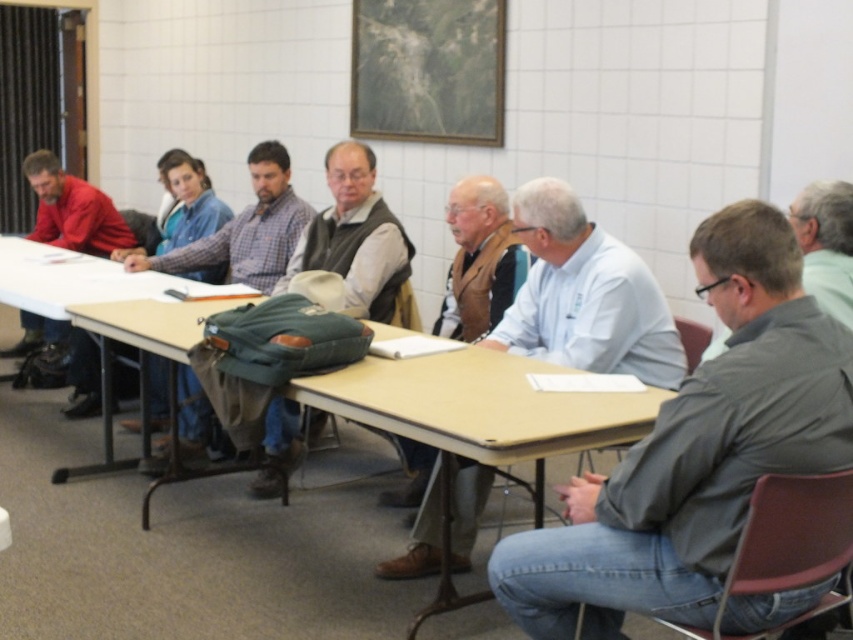
Does gray matte shirt at center have a lesser width compared to green fabric jacket at center?

No.

Based on the photo, can you confirm if gray matte shirt at center is positioned below green fabric jacket at center?

Correct, gray matte shirt at center is located below green fabric jacket at center.

Is point (564, 552) closer to viewer compared to point (347, 157)?

Yes, it is.

This screenshot has width=853, height=640. In order to click on gray matte shirt at center in this screenshot , I will do `click(695, 451)`.

Who is lower down, gray matte shirt at center or green fabric backpack at center?

gray matte shirt at center

Does gray matte shirt at center appear on the left side of green fabric backpack at center?

Incorrect, gray matte shirt at center is not on the left side of green fabric backpack at center.

Is point (564, 616) in front of point (258, 184)?

That is True.

Image resolution: width=853 pixels, height=640 pixels. What are the coordinates of `gray matte shirt at center` in the screenshot? It's located at (695, 451).

Is light blue shirt at center to the right of gray matte shirt at right from the viewer's perspective?

Incorrect, light blue shirt at center is not on the right side of gray matte shirt at right.

Can you confirm if light blue shirt at center is thinner than gray matte shirt at right?

No, light blue shirt at center is not thinner than gray matte shirt at right.

Where is `light blue shirt at center`? The height and width of the screenshot is (640, 853). light blue shirt at center is located at coordinates (572, 292).

In order to click on light blue shirt at center in this screenshot , I will do `click(572, 292)`.